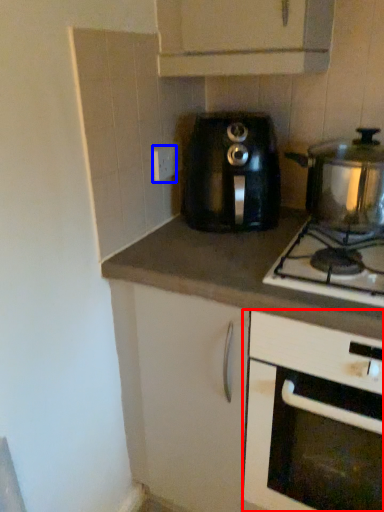
Question: Which object is further to the camera taking this photo, cabinetry (highlighted by a red box) or electric outlet (highlighted by a blue box)?

Choices:
 (A) cabinetry
 (B) electric outlet

Answer: (B)